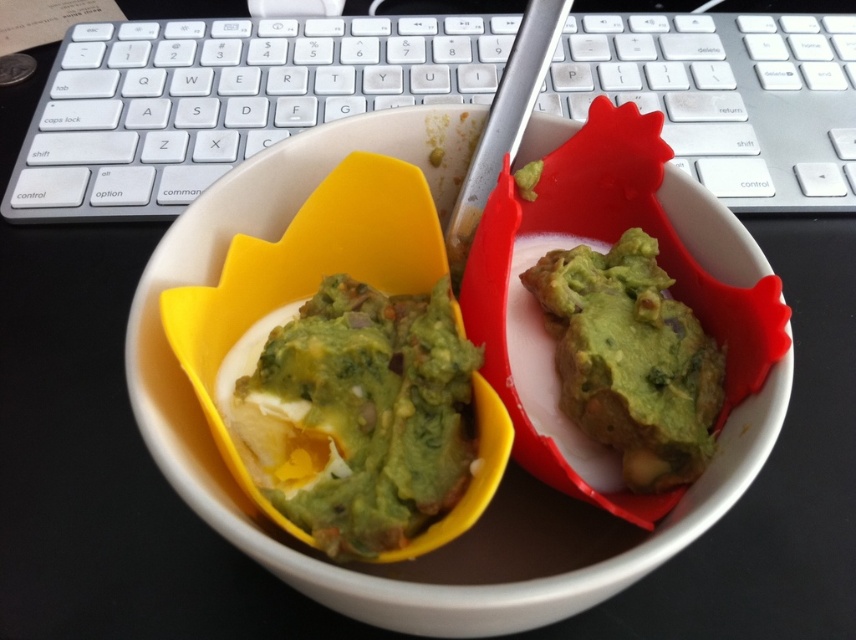
Question: Is green matte guacamole at center positioned before green matte guacamole at right?

Choices:
 (A) no
 (B) yes

Answer: (B)

Question: Which point is closer to the camera taking this photo?

Choices:
 (A) (745, 468)
 (B) (468, 467)

Answer: (A)

Question: Estimate the real-world distances between objects in this image. Which object is closer to the green matte guacamole at center?

Choices:
 (A) green matte guacamole at right
 (B) white matte bowl at center

Answer: (B)

Question: Which of the following is the closest to the observer?

Choices:
 (A) white matte bowl at center
 (B) green matte guacamole at center
 (C) green matte guacamole at right

Answer: (A)

Question: Can you confirm if white matte bowl at center is bigger than green matte guacamole at center?

Choices:
 (A) yes
 (B) no

Answer: (A)

Question: Can you confirm if green matte guacamole at center is positioned below green matte guacamole at right?

Choices:
 (A) yes
 (B) no

Answer: (A)